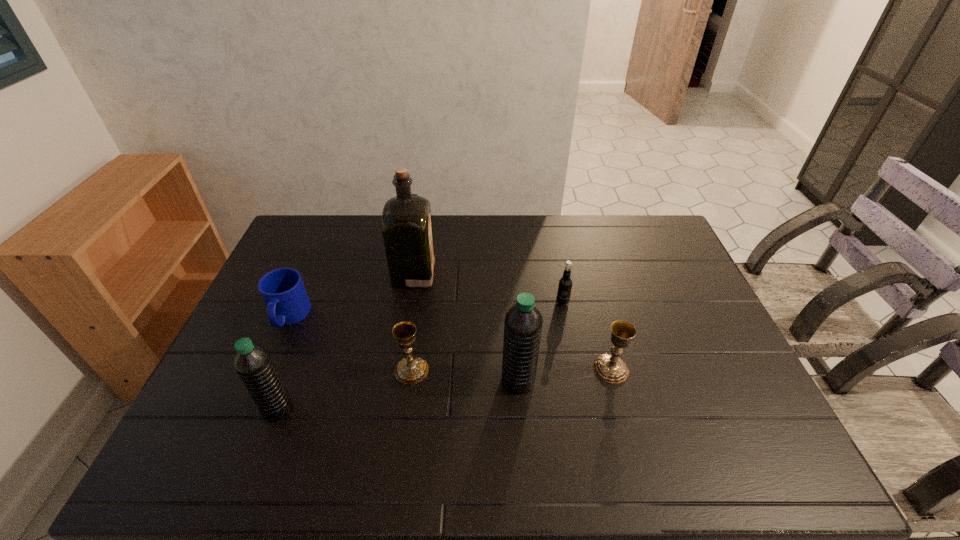
The image size is (960, 540). Identify the location of free spot that satisfies the following two spatial constraints: 1. on the label of the right chalice; 2. on the left side of the tallest object. (398, 369).

Where is `vacant space that satisfies the following two spatial constraints: 1. on the label of the farthest object; 2. on the back side of the taller water bottle`? vacant space that satisfies the following two spatial constraints: 1. on the label of the farthest object; 2. on the back side of the taller water bottle is located at coordinates (396, 380).

I want to click on vacant point that satisfies the following two spatial constraints: 1. on the label of the tallest object; 2. on the back side of the second tallest object, so click(x=396, y=380).